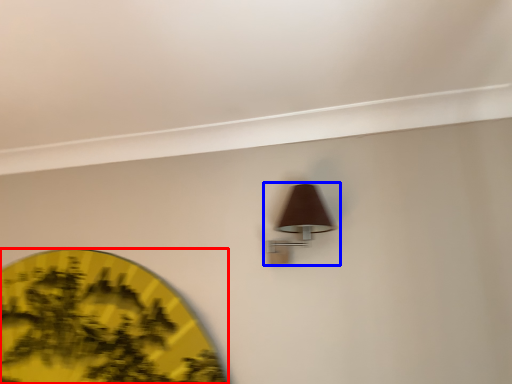
Question: Which object is closer to the camera taking this photo, circle (highlighted by a red box) or lamp (highlighted by a blue box)?

Choices:
 (A) circle
 (B) lamp

Answer: (B)